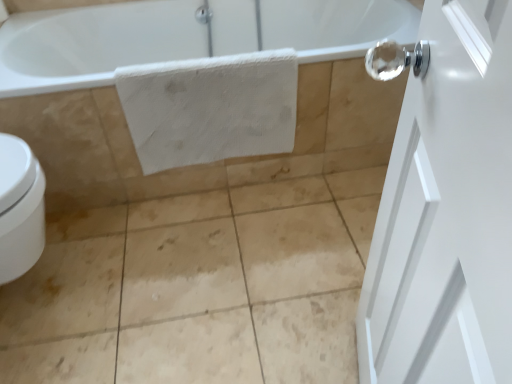
Question: Can you confirm if white textured towel at center is wider than white matte door at right?

Choices:
 (A) no
 (B) yes

Answer: (A)

Question: Can you confirm if white textured towel at center is taller than white matte door at right?

Choices:
 (A) yes
 (B) no

Answer: (B)

Question: From a real-world perspective, is white textured towel at center over white matte door at right?

Choices:
 (A) no
 (B) yes

Answer: (A)

Question: From the image's perspective, is white textured towel at center on top of white matte door at right?

Choices:
 (A) yes
 (B) no

Answer: (A)

Question: Does white textured towel at center come behind white matte door at right?

Choices:
 (A) no
 (B) yes

Answer: (B)

Question: Is white textured towel at center shorter than white matte door at right?

Choices:
 (A) yes
 (B) no

Answer: (A)

Question: From a real-world perspective, is white matte door at right positioned over white textured towel at center based on gravity?

Choices:
 (A) no
 (B) yes

Answer: (B)

Question: Is white matte door at right oriented away from white textured towel at center?

Choices:
 (A) yes
 (B) no

Answer: (B)

Question: Is white matte door at right thinner than white textured towel at center?

Choices:
 (A) yes
 (B) no

Answer: (B)

Question: Does white matte door at right come in front of white textured towel at center?

Choices:
 (A) no
 (B) yes

Answer: (B)

Question: From the image's perspective, is white matte door at right on white textured towel at center?

Choices:
 (A) no
 (B) yes

Answer: (A)

Question: Does white matte door at right have a larger size compared to white textured towel at center?

Choices:
 (A) no
 (B) yes

Answer: (B)

Question: Does point (421, 77) appear closer or farther from the camera than point (263, 69)?

Choices:
 (A) farther
 (B) closer

Answer: (B)